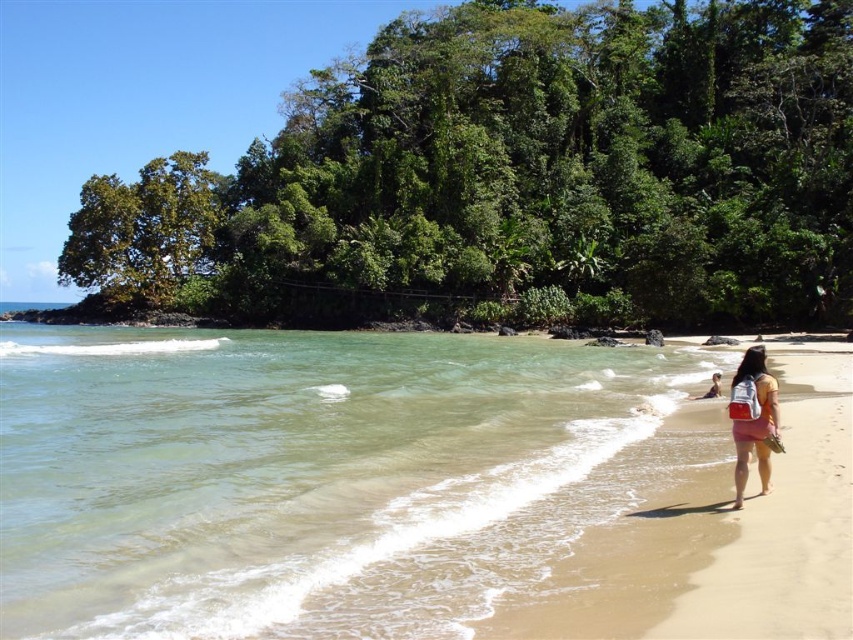
You are standing on the tan sandy beach at lower right and want to reach the clear water at beach right. Which direction should you move to get there?

You should move to the left since the clear water at beach right is to the left of tan sandy beach at lower right.

You are a photographer standing on the beach. You want to capture a photo of both the clear water at beach right and the matte pink shorts at lower right in the same frame. Based on their positions, which object will appear larger in the photo?

The matte pink shorts at lower right will appear larger in the photo because they are closer to the photographer than the clear water at beach right, which is further away.

You are standing on the beach and want to walk to both the point at coordinates point (x=42, y=624) and point (x=845, y=570). Which point should you reach first to minimize your walking distance?

You should reach point (x=42, y=624) first because it is closer to the camera than point (x=845, y=570), so it is nearer to your current position.